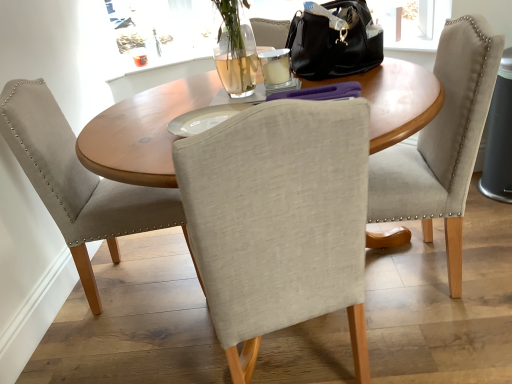
Find the location of a particular element. Image resolution: width=512 pixels, height=384 pixels. vacant area that is situated to the right of light gray fabric chair at center, which appears as the 1th chair when viewed from the right is located at coordinates (484, 243).